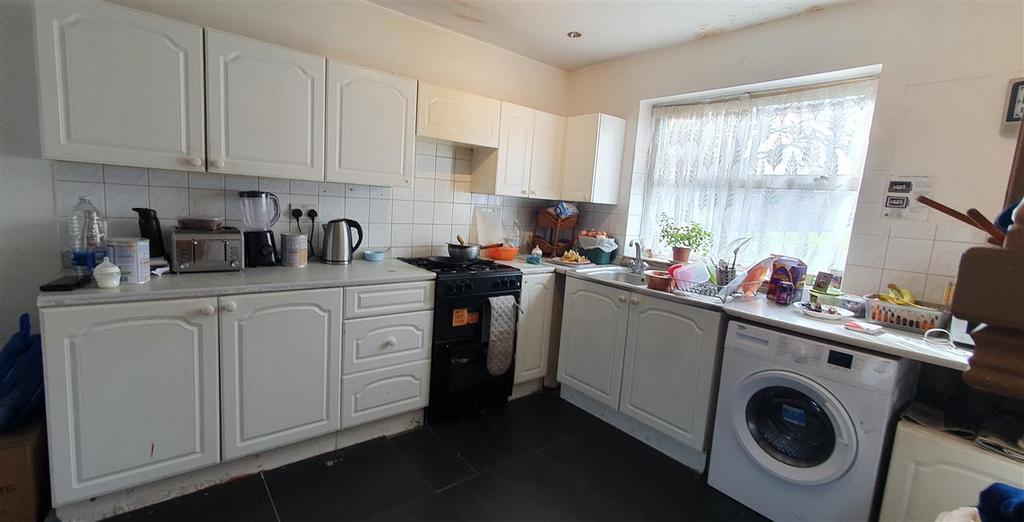
Identify the location of oven. (469, 340).